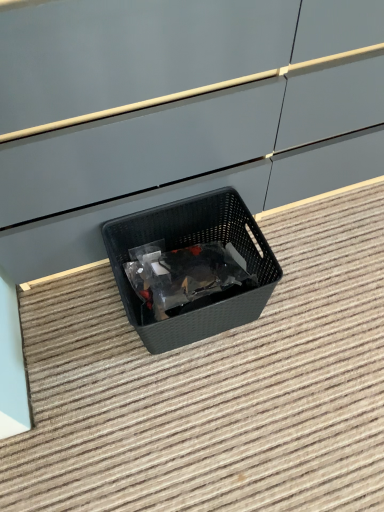
Describe the element at coordinates (193, 245) in the screenshot. I see `black plastic basket at center` at that location.

I want to click on black plastic basket at center, so click(x=193, y=245).

Measure the distance between point (137, 305) and camera.

They are 3.57 feet apart.

This screenshot has height=512, width=384. Describe the element at coordinates (215, 386) in the screenshot. I see `black plastic basket at center` at that location.

This screenshot has height=512, width=384. I want to click on black plastic basket at center, so click(x=215, y=386).

In order to face black plastic basket at center, should I rotate leftwards or rightwards?

Rotate your view right by about 7.499°.

Find the location of `black plastic basket at center`. black plastic basket at center is located at coordinates (193, 245).

Is black plastic basket at center to the right of black plastic basket at center from the viewer's perspective?

Yes.

In the scene shown: Which is in front, black plastic basket at center or black plastic basket at center?

Positioned in front is black plastic basket at center.

Which is farther from the camera, (253, 431) or (213, 309)?

Point (253, 431)

From the image's perspective, between black plastic basket at center and black plastic basket at center, which one is located above?

From the image's view, black plastic basket at center is above.

From a real-world perspective, is black plastic basket at center below black plastic basket at center?

Yes, from a real-world perspective, black plastic basket at center is below black plastic basket at center.

Considering the sizes of black plastic basket at center and black plastic basket at center in the image, is black plastic basket at center wider or thinner than black plastic basket at center?

black plastic basket at center is wider than black plastic basket at center.

Looking at this image, does black plastic basket at center have a greater height compared to black plastic basket at center?

Incorrect, the height of black plastic basket at center is not larger of that of black plastic basket at center.

In terms of size, does black plastic basket at center appear bigger or smaller than black plastic basket at center?

Clearly, black plastic basket at center is larger in size than black plastic basket at center.

Which is correct: black plastic basket at center is inside black plastic basket at center, or outside of it?

black plastic basket at center is outside black plastic basket at center.

Are black plastic basket at center and black plastic basket at center making contact?

There is a gap between black plastic basket at center and black plastic basket at center.

Could you tell me if black plastic basket at center is turned towards black plastic basket at center?

No.

Where is `waste container that appears on the left of black plastic basket at center`? Image resolution: width=384 pixels, height=512 pixels. waste container that appears on the left of black plastic basket at center is located at coordinates (193, 245).

Can you confirm if black plastic basket at center is positioned to the left of black plastic basket at center?

Correct, you'll find black plastic basket at center to the left of black plastic basket at center.

Is the depth of black plastic basket at center greater than that of black plastic basket at center?

Yes, black plastic basket at center is further from the viewer.

Is point (181, 330) closer to camera compared to point (126, 409)?

Yes, it is.

From the image's perspective, is black plastic basket at center on black plastic basket at center?

Indeed, from the image's perspective, black plastic basket at center is shown above black plastic basket at center.

From a real-world perspective, which object stands above the other?

black plastic basket at center, from a real-world perspective.

Is black plastic basket at center wider or thinner than black plastic basket at center?

Clearly, black plastic basket at center has less width compared to black plastic basket at center.

Does black plastic basket at center have a lesser height compared to black plastic basket at center?

No, black plastic basket at center is not shorter than black plastic basket at center.

Does black plastic basket at center have a larger size compared to black plastic basket at center?

Actually, black plastic basket at center might be smaller than black plastic basket at center.

Is black plastic basket at center spatially inside black plastic basket at center, or outside of it?

The correct answer is: outside.

Consider the image. Is black plastic basket at center far from black plastic basket at center?

That's not correct — black plastic basket at center is a little close to black plastic basket at center.

Does black plastic basket at center turn towards black plastic basket at center?

Yes, black plastic basket at center faces towards black plastic basket at center.

How different are the orientations of black plastic basket at center and black plastic basket at center in degrees?

The angle between the facing direction of black plastic basket at center and the facing direction of black plastic basket at center is 179 degrees.

How much distance is there between black plastic basket at center and black plastic basket at center?

black plastic basket at center is 19.05 centimeters away from black plastic basket at center.

Locate an element on the screen. stair below the black plastic basket at center (from the image's perspective) is located at coordinates pyautogui.click(x=215, y=386).

Image resolution: width=384 pixels, height=512 pixels. In order to click on stair that appears below the black plastic basket at center (from the image's perspective) in this screenshot , I will do `click(215, 386)`.

Image resolution: width=384 pixels, height=512 pixels. Identify the location of stair that is under the black plastic basket at center (from a real-world perspective). (215, 386).